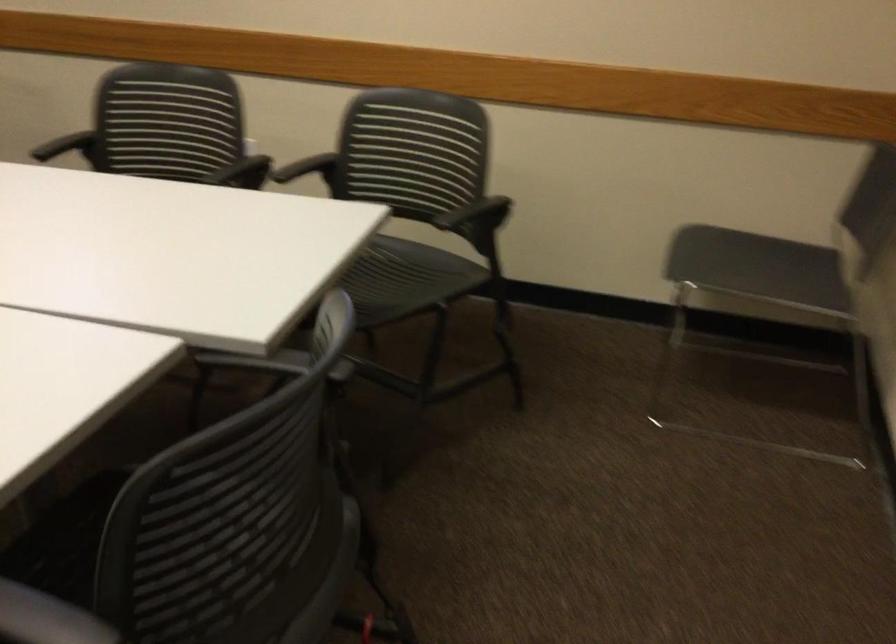
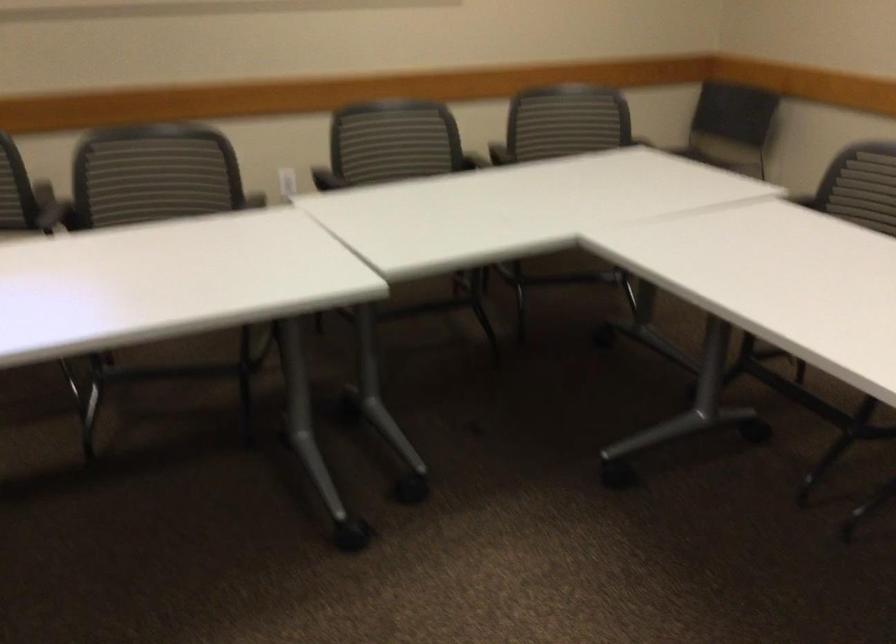
In the second image, find the point that corresponds to point 629,149 in the first image.

(569, 114)